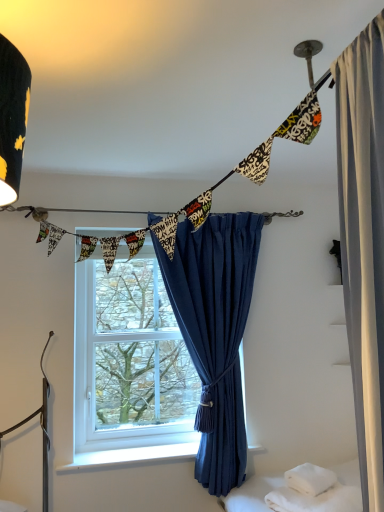
Question: Can you confirm if printed fabric bunting at upper center is positioned to the left of white soft pillow at lower right?

Choices:
 (A) no
 (B) yes

Answer: (B)

Question: Could you tell me if printed fabric bunting at upper center is turned towards white soft pillow at lower right?

Choices:
 (A) no
 (B) yes

Answer: (A)

Question: Is printed fabric bunting at upper center to the right of white soft pillow at lower right from the viewer's perspective?

Choices:
 (A) yes
 (B) no

Answer: (B)

Question: Is printed fabric bunting at upper center shorter than white soft pillow at lower right?

Choices:
 (A) no
 (B) yes

Answer: (A)

Question: Would you say printed fabric bunting at upper center is a long distance from white soft pillow at lower right?

Choices:
 (A) no
 (B) yes

Answer: (B)

Question: Choose the correct answer: Is white soft pillow at lower right inside blue velvet curtain at center or outside it?

Choices:
 (A) outside
 (B) inside

Answer: (A)

Question: From the image's perspective, is white soft pillow at lower right above or below blue velvet curtain at center?

Choices:
 (A) above
 (B) below

Answer: (B)

Question: Is white soft pillow at lower right in front of or behind blue velvet curtain at center in the image?

Choices:
 (A) front
 (B) behind

Answer: (A)

Question: From a real-world perspective, is white soft pillow at lower right above or below blue velvet curtain at center?

Choices:
 (A) above
 (B) below

Answer: (B)

Question: Is white smooth window sill at lower center in front of or behind blue velvet curtain at center in the image?

Choices:
 (A) front
 (B) behind

Answer: (B)

Question: Is white smooth window sill at lower center situated inside blue velvet curtain at center or outside?

Choices:
 (A) outside
 (B) inside

Answer: (A)

Question: Is point pos(140,461) positioned closer to the camera than point pos(230,465)?

Choices:
 (A) farther
 (B) closer

Answer: (A)

Question: From the image's perspective, is white smooth window sill at lower center positioned above or below blue velvet curtain at center?

Choices:
 (A) above
 (B) below

Answer: (B)

Question: From a real-world perspective, relative to white soft towel at lower right, is printed fabric bunting at upper center vertically above or below?

Choices:
 (A) below
 (B) above

Answer: (B)

Question: From the image's perspective, is printed fabric bunting at upper center above or below white soft towel at lower right?

Choices:
 (A) below
 (B) above

Answer: (B)